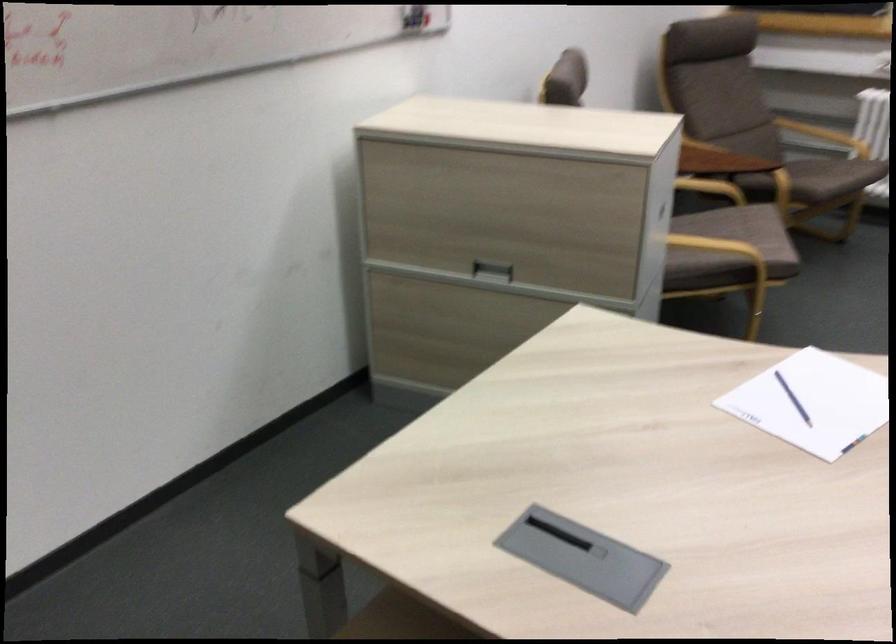
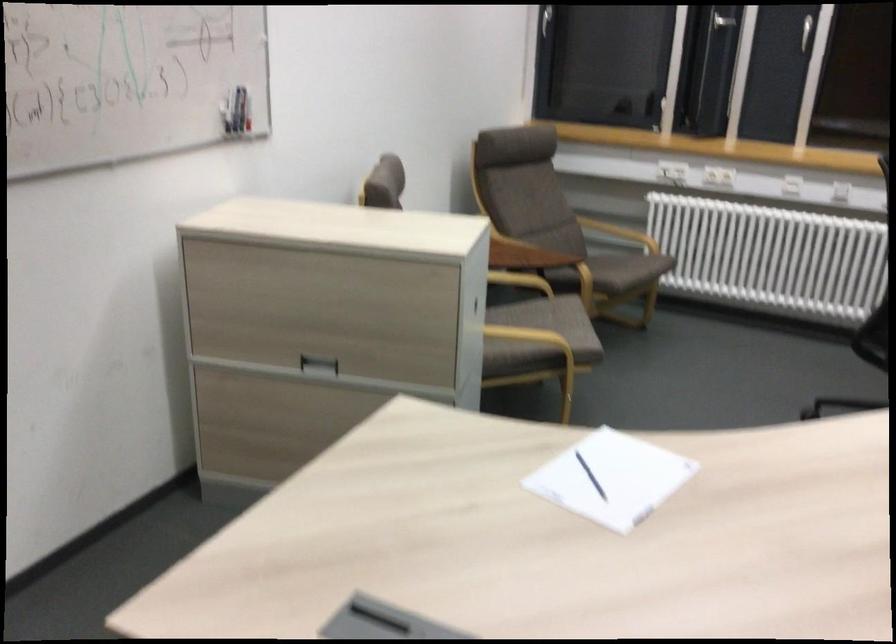
In the second image, find the point that corresponds to (743,232) in the first image.

(552, 321)